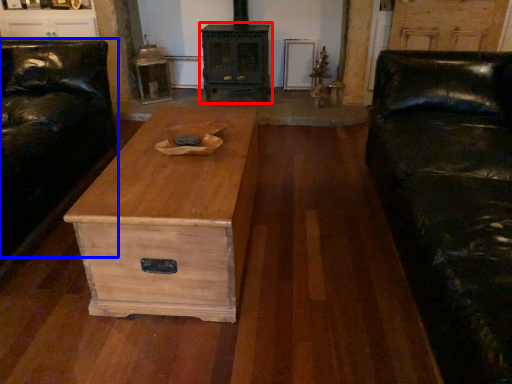
Question: Which point is closer to the camera, stove (highlighted by a red box) or couch (highlighted by a blue box)?

Choices:
 (A) stove
 (B) couch

Answer: (B)